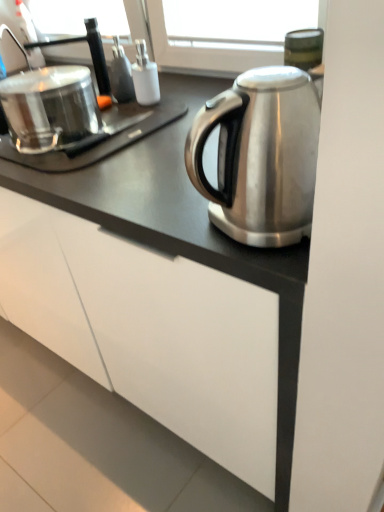
I want to click on vacant area that lies to the right of shiny metallic pot at left, so click(x=157, y=135).